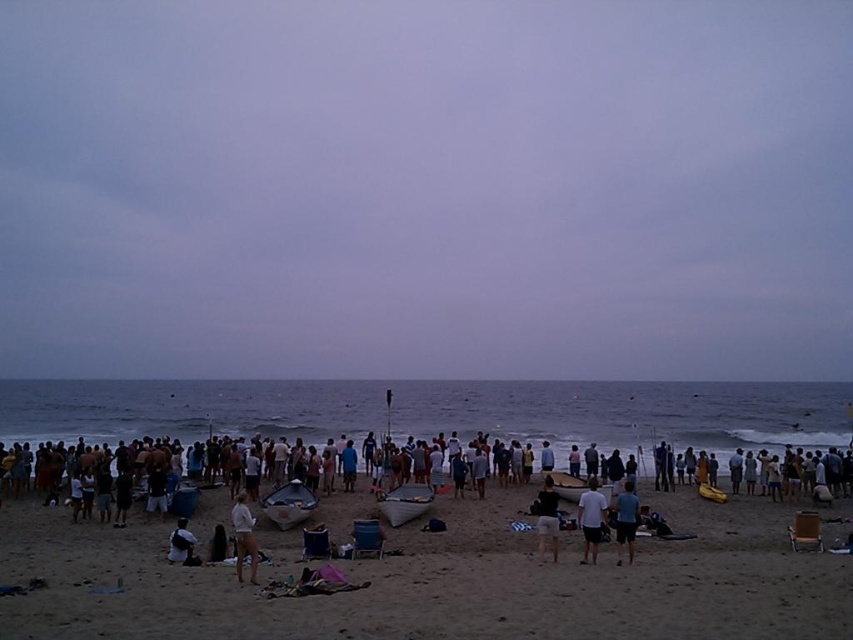
Between white plastic boat at center and blue fabric shorts at center, which one has less height?

With less height is white plastic boat at center.

Is point (389, 502) positioned before point (630, 516)?

That is False.

Locate an element on the screen. white plastic boat at center is located at coordinates (404, 502).

Who is more distant from viewer, (546,531) or (184,540)?

The point (184,540) is behind.

Based on the photo, can you confirm if black fabric person at center is shorter than white cotton shirt at lower left?

No, black fabric person at center is not shorter than white cotton shirt at lower left.

Which is in front, point (550, 513) or point (183, 538)?

Point (550, 513)

Find the location of a particular element. black fabric person at center is located at coordinates (547, 516).

Is white fabric at center thinner than black fabric person at center?

No.

Does white fabric at center have a greater height compared to black fabric person at center?

Incorrect, white fabric at center's height is not larger of black fabric person at center's.

Is point (235, 572) positioned before point (554, 532)?

Yes, point (235, 572) is closer to viewer.

Where is `white fabric at center`? The height and width of the screenshot is (640, 853). white fabric at center is located at coordinates (242, 536).